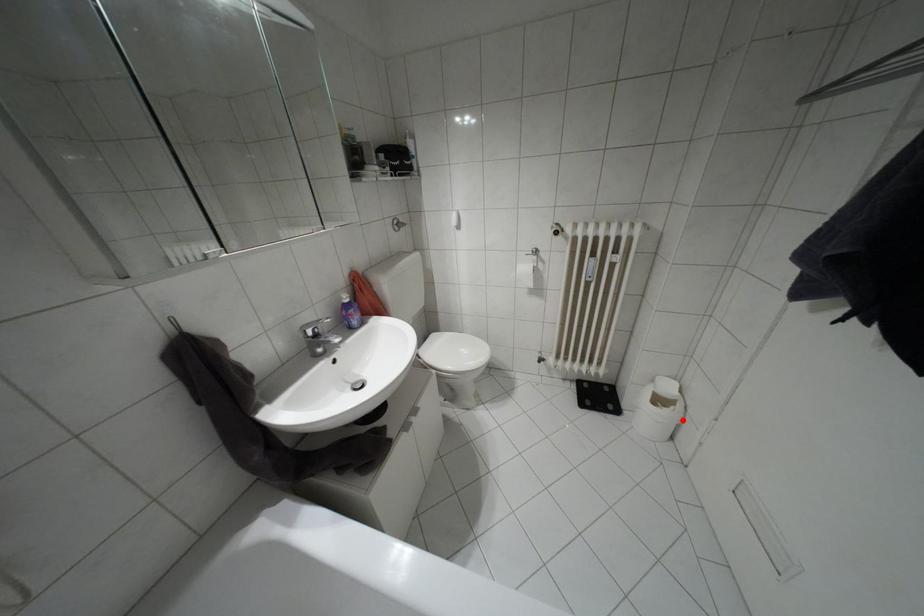
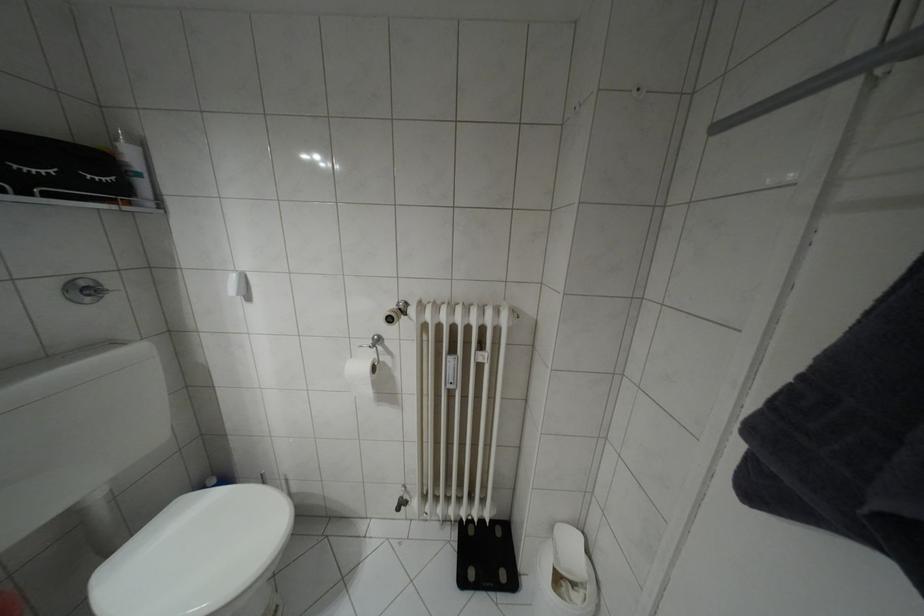
In the second image, find the point that corresponds to the highlighted location in the first image.

(598, 606)